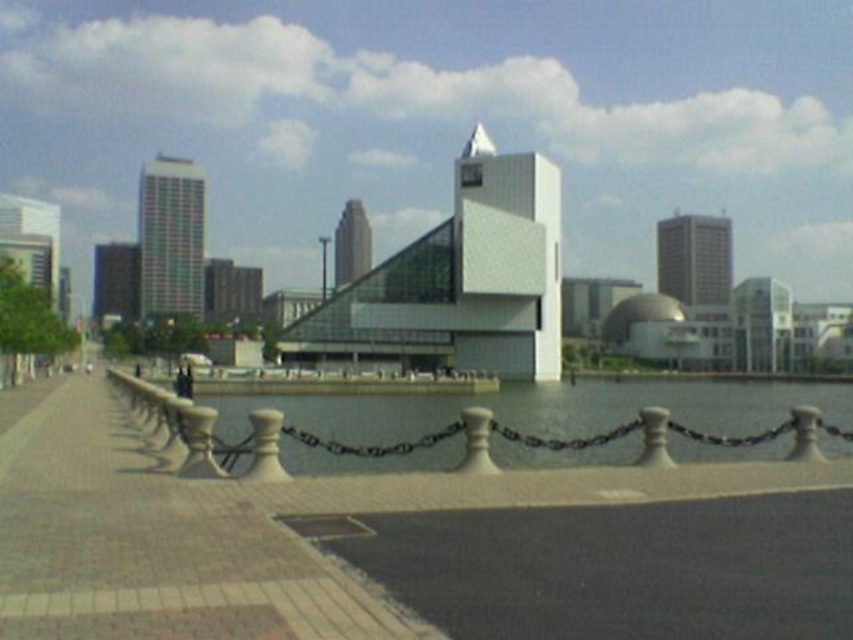
Question: Which point is farther from the camera taking this photo?

Choices:
 (A) (142, 545)
 (B) (294, 438)

Answer: (B)

Question: Is the position of concrete paving at center more distant than that of clear glass water at center?

Choices:
 (A) yes
 (B) no

Answer: (B)

Question: Among these points, which one is farthest from the camera?

Choices:
 (A) (173, 557)
 (B) (579, 408)

Answer: (B)

Question: Observing the image, what is the correct spatial positioning of concrete paving at center in reference to clear glass water at center?

Choices:
 (A) below
 (B) above

Answer: (B)

Question: Which of the following is the farthest from the observer?

Choices:
 (A) concrete paving at center
 (B) clear glass water at center

Answer: (B)

Question: Considering the relative positions of concrete paving at center and clear glass water at center in the image provided, where is concrete paving at center located with respect to clear glass water at center?

Choices:
 (A) left
 (B) right

Answer: (A)